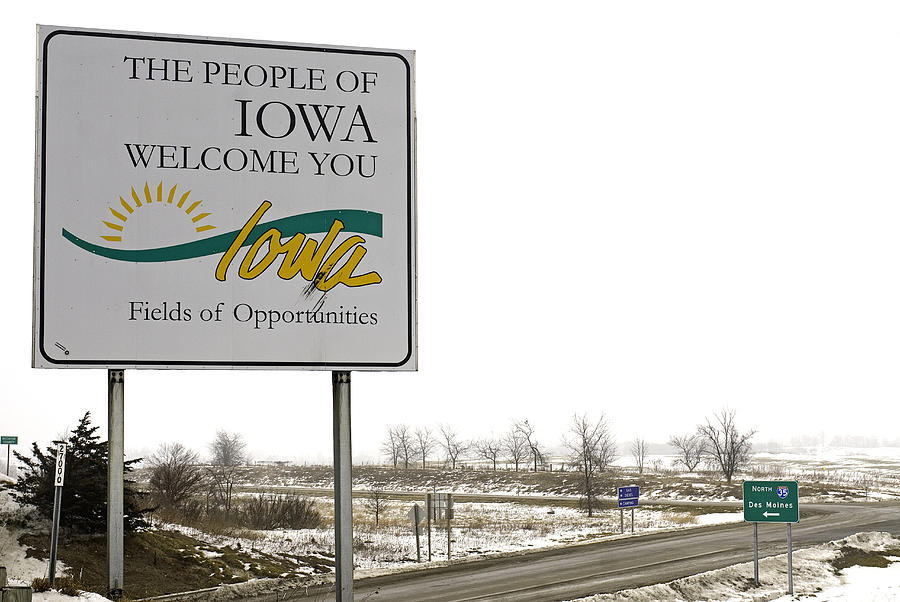
Locate an element on the screen. This screenshot has width=900, height=602. black border on welcome sign is located at coordinates coord(406,355).